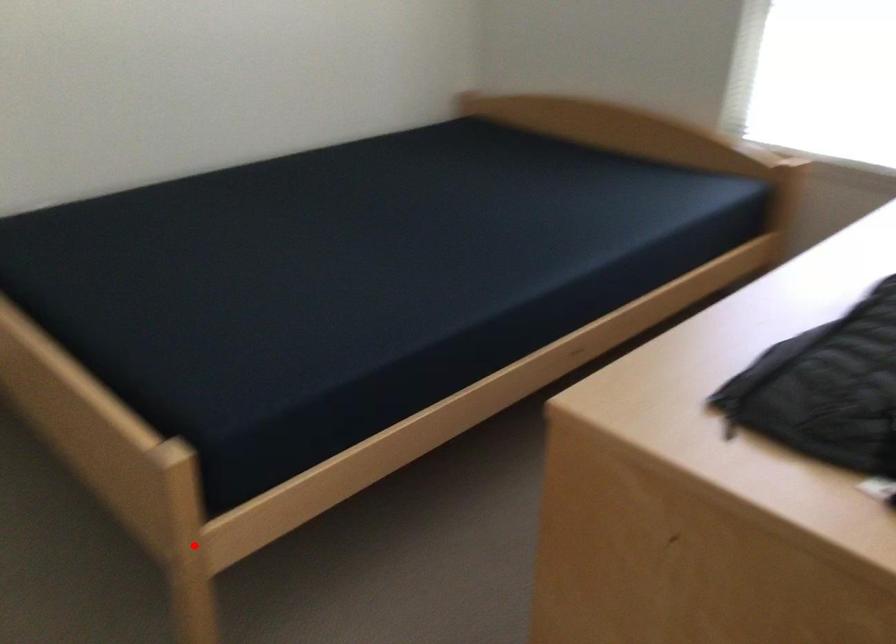
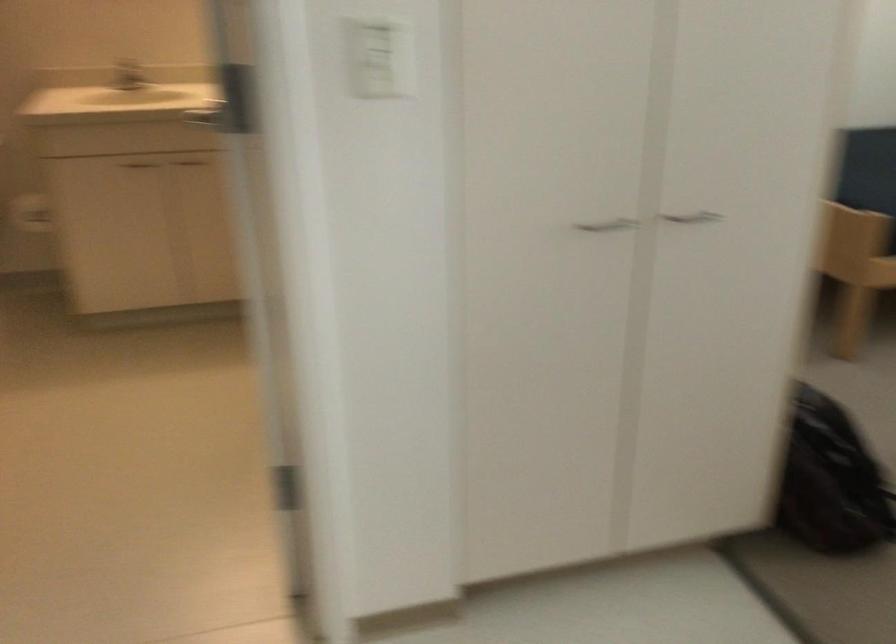
Locate, in the second image, the point that corresponds to the highlighted location in the first image.

(855, 269)